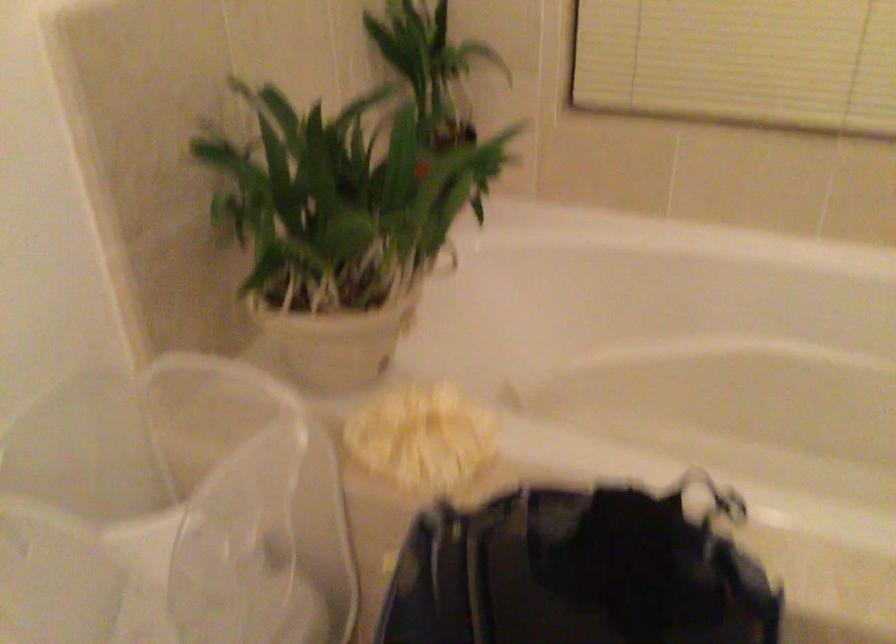
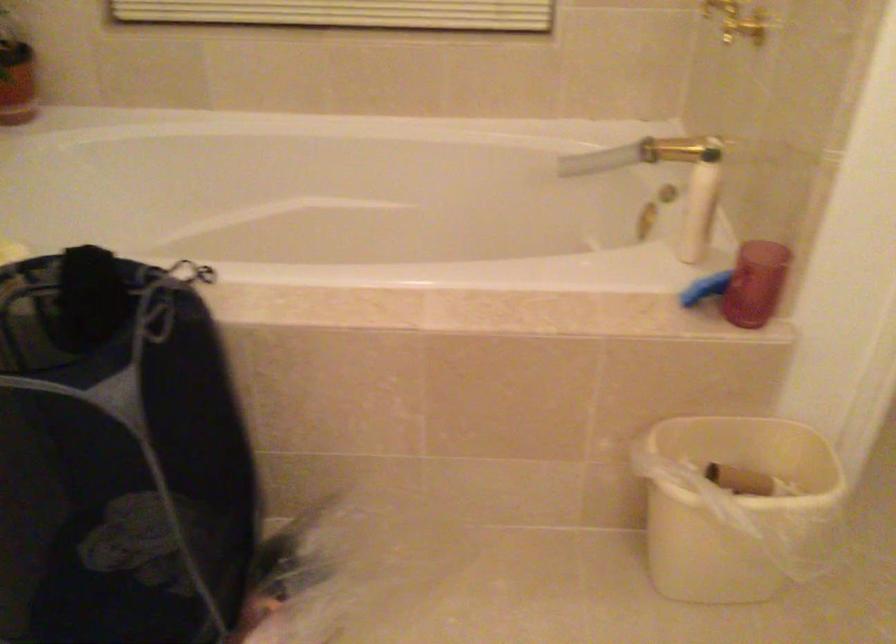
Question: Based on the continuous images, in which direction is the camera rotating? Reply with the corresponding letter.

Choices:
 (A) Left
 (B) Right
 (C) Up
 (D) Down

Answer: (B)